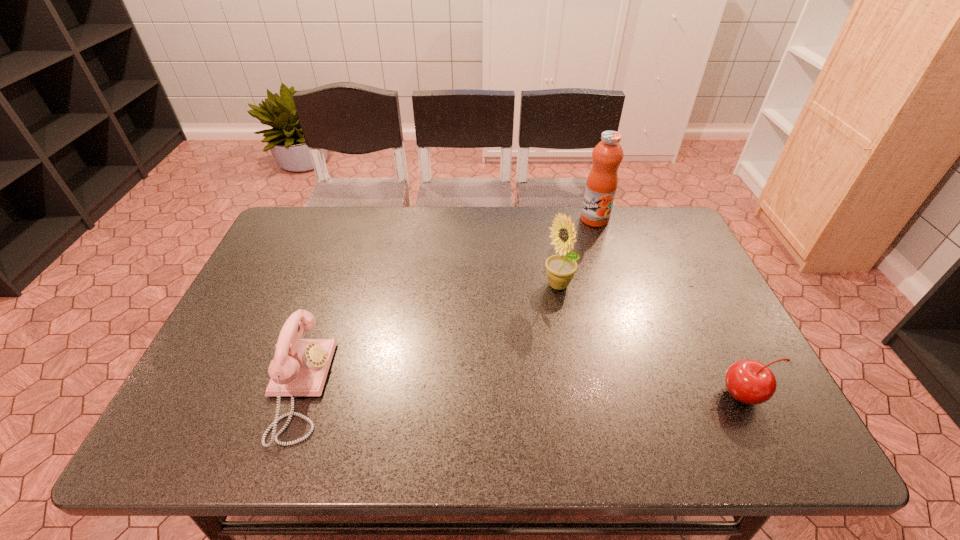
Identify the location of object located in the near right corner section of the desktop. The image size is (960, 540). (750, 382).

At what (x,y) coordinates should I click in order to perform the action: click on vacant area at the far edge of the desktop. Please return your answer as a coordinate pair (x, y). This screenshot has width=960, height=540. Looking at the image, I should click on (393, 228).

Locate an element on the screen. This screenshot has height=540, width=960. vacant space at the near edge of the desktop is located at coordinates (604, 384).

Where is `vacant space at the left edge`? This screenshot has height=540, width=960. vacant space at the left edge is located at coordinates (228, 357).

The image size is (960, 540). Find the location of `vacant space at the right edge of the desktop`. vacant space at the right edge of the desktop is located at coordinates (663, 253).

At what (x,y) coordinates should I click in order to perform the action: click on free space at the far right corner of the desktop. Please return your answer as a coordinate pair (x, y). Looking at the image, I should click on (652, 231).

Image resolution: width=960 pixels, height=540 pixels. What are the coordinates of `vacant space that is in between the shortest object and the farthest object` in the screenshot? It's located at [x=669, y=307].

Identify the location of free space between the second farthest object and the cherry. The image size is (960, 540). (652, 341).

Identify the location of vacant space in between the sunflower and the leftmost object. (428, 338).

Image resolution: width=960 pixels, height=540 pixels. Find the location of `free space between the telephone and the sunflower`. free space between the telephone and the sunflower is located at coordinates (428, 338).